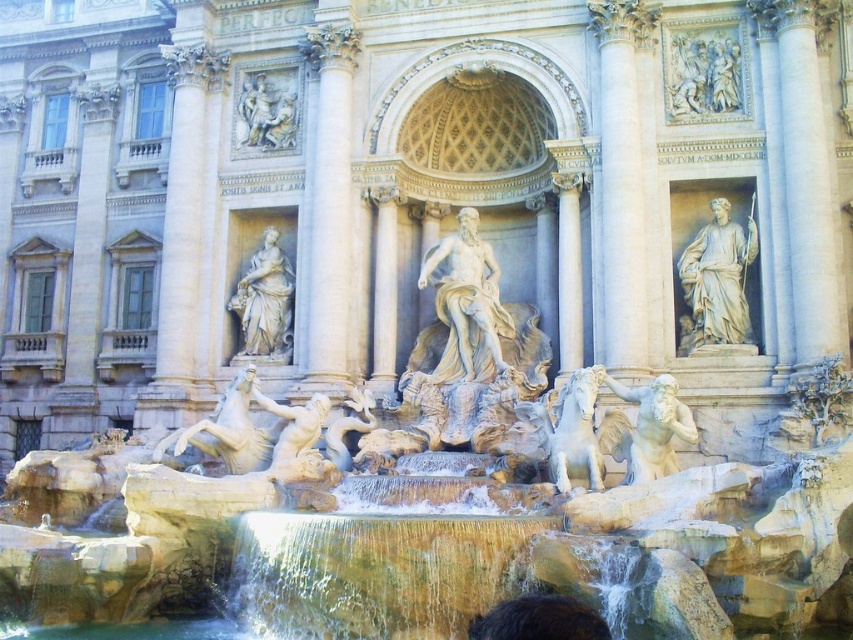
Is white marble relief at upper right closer to camera compared to white marble statue at lower right?

No, it is behind white marble statue at lower right.

Based on the photo, does white marble relief at upper right have a lesser width compared to white marble statue at lower right?

Indeed, white marble relief at upper right has a lesser width compared to white marble statue at lower right.

Locate an element on the screen. The height and width of the screenshot is (640, 853). white marble relief at upper right is located at coordinates (703, 74).

Who is positioned more to the right, white marble horse at center or dark brown hair at lower center?

From the viewer's perspective, dark brown hair at lower center appears more on the right side.

Can you confirm if white marble horse at center is smaller than dark brown hair at lower center?

Actually, white marble horse at center might be larger than dark brown hair at lower center.

Who is more forward, (227, 408) or (561, 609)?

Point (561, 609) is more forward.

Identify the location of white marble horse at center. (229, 429).

Between white marble relief at upper right and white marble statue at upper center, which one appears on the right side from the viewer's perspective?

From the viewer's perspective, white marble relief at upper right appears more on the right side.

Is point (737, 72) less distant than point (288, 124)?

That is True.

This screenshot has width=853, height=640. I want to click on white marble relief at upper right, so click(703, 74).